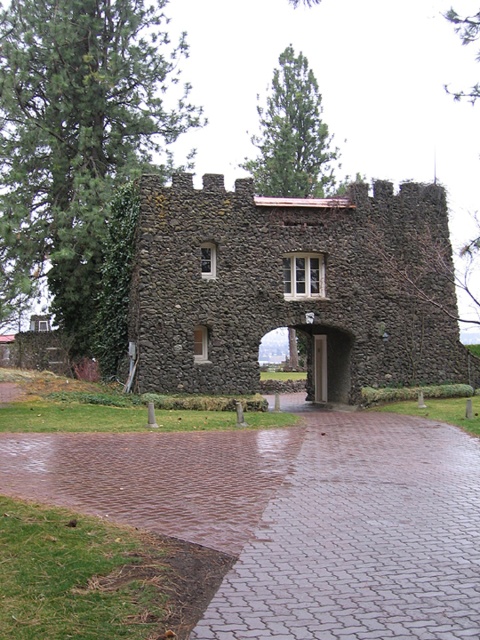
Question: Which object appears closest to the camera in this image?

Choices:
 (A) green ivy at left
 (B) rustic stone gate at center
 (C) brick paved path at center

Answer: (C)

Question: Which object is farther from the camera taking this photo?

Choices:
 (A) brick paved path at center
 (B) rustic stone gate at center
 (C) green ivy at left

Answer: (C)

Question: Does rustic stone gate at center lie in front of green ivy at left?

Choices:
 (A) yes
 (B) no

Answer: (A)

Question: Considering the relative positions of rustic stone gate at center and green ivy at left in the image provided, where is rustic stone gate at center located with respect to green ivy at left?

Choices:
 (A) below
 (B) above

Answer: (A)

Question: Can you confirm if rustic stone gate at center is positioned to the left of green ivy at left?

Choices:
 (A) yes
 (B) no

Answer: (B)

Question: Estimate the real-world distances between objects in this image. Which object is closer to the brick paved path at center?

Choices:
 (A) rustic stone gate at center
 (B) green ivy at left

Answer: (A)